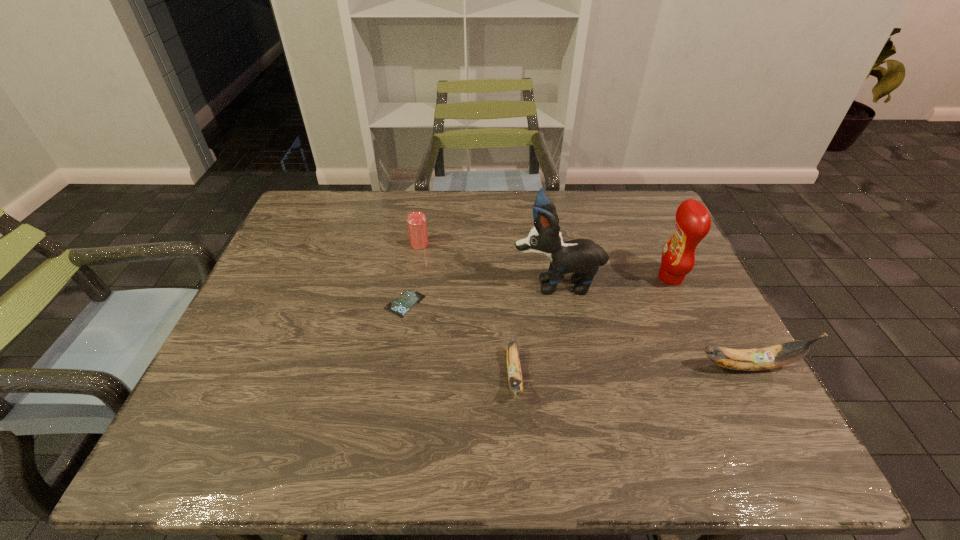
This screenshot has height=540, width=960. Identify the location of free space at the far edge of the desktop. (395, 209).

Find the location of a particular element. The image size is (960, 540). free region at the near edge of the desktop is located at coordinates (579, 384).

At what (x,y) coordinates should I click in order to perform the action: click on vacant space at the left edge of the desktop. Please return your answer as a coordinate pair (x, y). Image resolution: width=960 pixels, height=540 pixels. Looking at the image, I should click on (294, 274).

You are a GUI agent. You are given a task and a screenshot of the screen. Output one action in this format:
    pyautogui.click(x=<x>, y=<y>)
    Task: Click on the blank space at the right edge of the desktop
    The width and height of the screenshot is (960, 540).
    Given the screenshot: What is the action you would take?
    pyautogui.click(x=729, y=369)

In the image, there is a desktop. Where is `vacant area at the far left corner`? The image size is (960, 540). vacant area at the far left corner is located at coordinates (319, 199).

You are a GUI agent. You are given a task and a screenshot of the screen. Output one action in this format:
    pyautogui.click(x=<x>, y=<y>)
    Task: Click on the free space at the near left corner of the desktop
    This screenshot has height=540, width=960.
    Given the screenshot: What is the action you would take?
    pyautogui.click(x=204, y=390)

Identify the location of free space that is in between the puppy and the second tallest object. (613, 280).

Identify the location of vacant area that lies between the tallest object and the identity card. 481,293.

You are a GUI agent. You are given a task and a screenshot of the screen. Output one action in this format:
    pyautogui.click(x=<x>, y=<y>)
    Task: Click on the empty location between the beer can and the identity card
    
    Given the screenshot: What is the action you would take?
    pyautogui.click(x=412, y=274)

Locate an element on the screen. The image size is (960, 540). blank region between the shorter banana and the identity card is located at coordinates (460, 340).